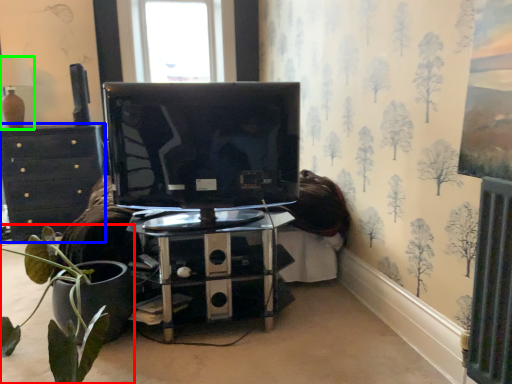
Question: Estimate the real-world distances between objects in this image. Which object is closer to houseplant (highlighted by a red box), chest of drawers (highlighted by a blue box) or lamp (highlighted by a green box)?

Choices:
 (A) chest of drawers
 (B) lamp

Answer: (A)